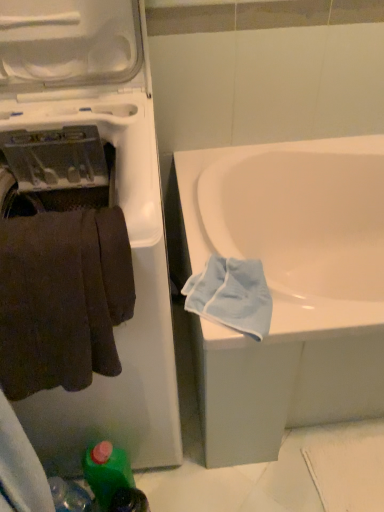
Question: From the image's perspective, does green plastic bottle at lower left appear lower than white glossy bathtub at center?

Choices:
 (A) no
 (B) yes

Answer: (B)

Question: From a real-world perspective, is green plastic bottle at lower left located higher than white glossy bathtub at center?

Choices:
 (A) no
 (B) yes

Answer: (A)

Question: Is the position of green plastic bottle at lower left more distant than that of white glossy bathtub at center?

Choices:
 (A) no
 (B) yes

Answer: (B)

Question: Does green plastic bottle at lower left have a smaller size compared to white glossy bathtub at center?

Choices:
 (A) no
 (B) yes

Answer: (B)

Question: Does green plastic bottle at lower left have a greater height compared to white glossy bathtub at center?

Choices:
 (A) yes
 (B) no

Answer: (B)

Question: Is green plastic bottle at lower left turned away from white glossy bathtub at center?

Choices:
 (A) no
 (B) yes

Answer: (A)

Question: Is light blue cotton towel at lower right aimed at white plastic washing machine at left?

Choices:
 (A) no
 (B) yes

Answer: (A)

Question: Does light blue cotton towel at lower right touch white plastic washing machine at left?

Choices:
 (A) yes
 (B) no

Answer: (B)

Question: Does light blue cotton towel at lower right have a greater width compared to white plastic washing machine at left?

Choices:
 (A) no
 (B) yes

Answer: (A)

Question: Can you confirm if light blue cotton towel at lower right is shorter than white plastic washing machine at left?

Choices:
 (A) no
 (B) yes

Answer: (B)

Question: Is the depth of light blue cotton towel at lower right less than that of white plastic washing machine at left?

Choices:
 (A) yes
 (B) no

Answer: (B)

Question: Does light blue cotton towel at lower right appear on the left side of white plastic washing machine at left?

Choices:
 (A) no
 (B) yes

Answer: (A)

Question: Is white glossy bathtub at center further to the viewer compared to white plastic washing machine at left?

Choices:
 (A) no
 (B) yes

Answer: (B)